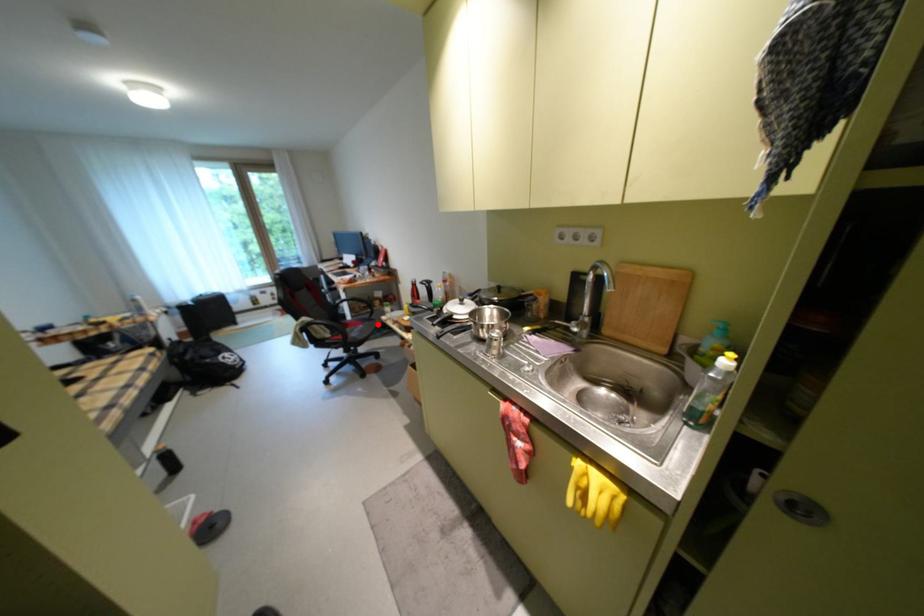
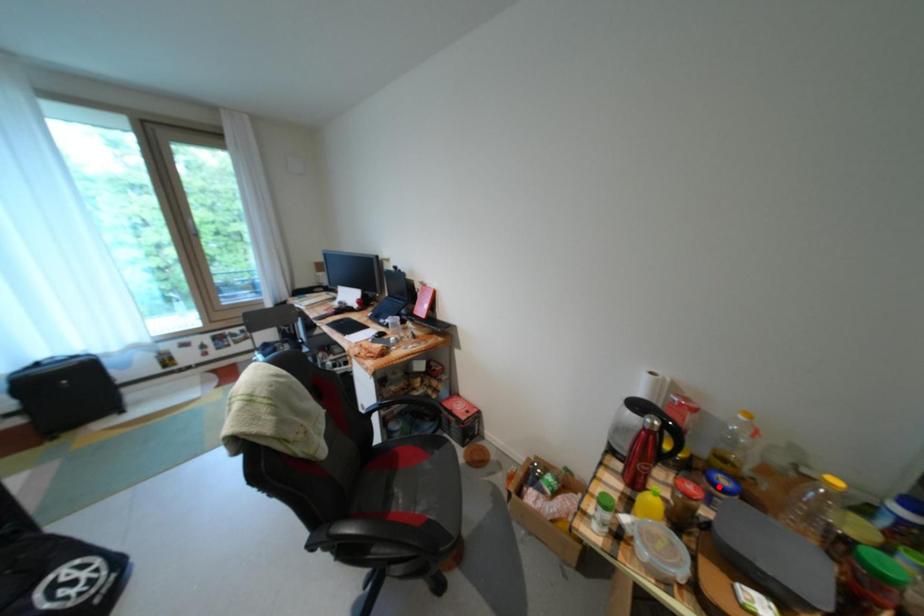
I am providing you with two images of the same scene from different viewpoints. A red point is marked on the first image and another point is marked on the second image. Do the highlighted points in image1 and image2 indicate the same real-world spot?

No